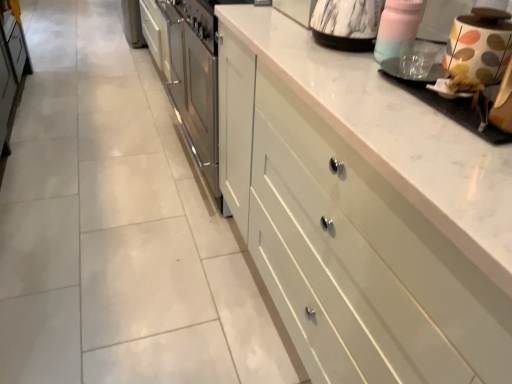
Question: Considering the relative sizes of white glossy coffee machine at upper right and transparent plastic cup at upper right, which is counted as the second appliance, starting from the left, in the image provided, is white glossy coffee machine at upper right shorter than transparent plastic cup at upper right, which is counted as the second appliance, starting from the left,?

Choices:
 (A) yes
 (B) no

Answer: (A)

Question: Is white glossy coffee machine at upper right next to transparent plastic cup at upper right, which appears as the 2th appliance when viewed from the right?

Choices:
 (A) no
 (B) yes

Answer: (B)

Question: From the image's perspective, does white glossy coffee machine at upper right appear higher than transparent plastic cup at upper right, which appears as the 2th appliance when viewed from the right?

Choices:
 (A) no
 (B) yes

Answer: (A)

Question: Is there a large distance between white glossy coffee machine at upper right and transparent plastic cup at upper right, which is counted as the second appliance, starting from the left?

Choices:
 (A) yes
 (B) no

Answer: (B)

Question: Can you confirm if white glossy coffee machine at upper right is taller than transparent plastic cup at upper right, which is counted as the second appliance, starting from the left?

Choices:
 (A) yes
 (B) no

Answer: (B)

Question: From a real-world perspective, is transparent plastic cup at upper right, which is counted as the second appliance, starting from the left, positioned above or below marble-patterned kettle at upper right, acting as the 3th appliance starting from the right?

Choices:
 (A) below
 (B) above

Answer: (A)

Question: Would you say transparent plastic cup at upper right, which appears as the 2th appliance when viewed from the right, is to the left or to the right of marble-patterned kettle at upper right, acting as the 3th appliance starting from the right, in the picture?

Choices:
 (A) right
 (B) left

Answer: (A)

Question: Which is correct: transparent plastic cup at upper right, which appears as the 2th appliance when viewed from the right, is inside marble-patterned kettle at upper right, acting as the 3th appliance starting from the right, or outside of it?

Choices:
 (A) inside
 (B) outside

Answer: (B)

Question: Considering the positions of point (422, 74) and point (316, 11), is point (422, 74) closer or farther from the camera than point (316, 11)?

Choices:
 (A) closer
 (B) farther

Answer: (A)

Question: Would you say white glossy coffee machine at upper right is inside or outside transparent plastic cup at upper right, which is counted as the second appliance, starting from the left?

Choices:
 (A) outside
 (B) inside

Answer: (A)

Question: Is white glossy coffee machine at upper right wider or thinner than transparent plastic cup at upper right, which appears as the 2th appliance when viewed from the right?

Choices:
 (A) thin
 (B) wide

Answer: (B)

Question: Is white glossy coffee machine at upper right taller or shorter than transparent plastic cup at upper right, which appears as the 2th appliance when viewed from the right?

Choices:
 (A) tall
 (B) short

Answer: (B)

Question: From a real-world perspective, is white glossy coffee machine at upper right physically located above or below transparent plastic cup at upper right, which is counted as the second appliance, starting from the left?

Choices:
 (A) below
 (B) above

Answer: (A)

Question: Is point (485, 269) positioned closer to the camera than point (418, 69)?

Choices:
 (A) farther
 (B) closer

Answer: (B)

Question: From a real-world perspective, relative to transparent plastic cup at upper right, which appears as the 2th appliance when viewed from the right, is white painted wood drawers at center vertically above or below?

Choices:
 (A) below
 (B) above

Answer: (A)